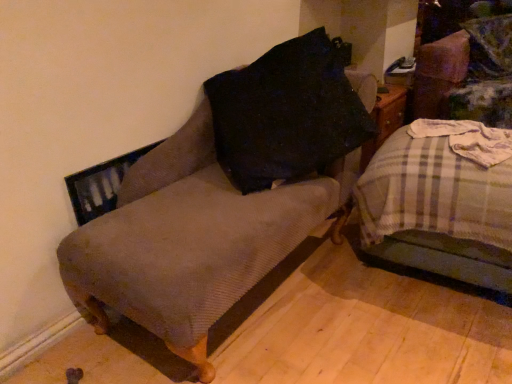
Question: Is velvet green swivel chair at upper right bigger or smaller than textured brown armchair at left?

Choices:
 (A) small
 (B) big

Answer: (A)

Question: Is velvet green swivel chair at upper right in front of or behind textured brown armchair at left in the image?

Choices:
 (A) front
 (B) behind

Answer: (B)

Question: Estimate the real-world distances between objects in this image. Which object is closer to the plaid fabric bed at right?

Choices:
 (A) velvet green swivel chair at upper right
 (B) textured brown armchair at left

Answer: (B)

Question: Estimate the real-world distances between objects in this image. Which object is closer to the plaid fabric bed at right?

Choices:
 (A) textured brown armchair at left
 (B) velvet green swivel chair at upper right

Answer: (A)